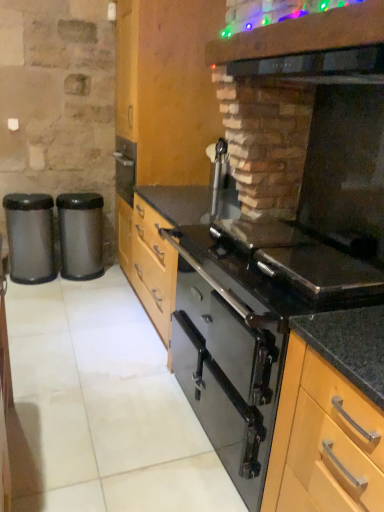
Question: Is light wood cabinet at center, which is the second cabinetry from back to front, thinner than black glass oven at center?

Choices:
 (A) yes
 (B) no

Answer: (A)

Question: From a real-world perspective, is light wood cabinet at center, which is the second cabinetry from back to front, beneath black glass oven at center?

Choices:
 (A) yes
 (B) no

Answer: (B)

Question: From a real-world perspective, is light wood cabinet at center, arranged as the 1th cabinetry when viewed from the right, physically above black glass oven at center?

Choices:
 (A) yes
 (B) no

Answer: (A)

Question: Is light wood cabinet at center, marked as the 1th cabinetry in a front-to-back arrangement, positioned before black glass oven at center?

Choices:
 (A) no
 (B) yes

Answer: (B)

Question: Can you confirm if light wood cabinet at center, marked as the 1th cabinetry in a front-to-back arrangement, is bigger than black glass oven at center?

Choices:
 (A) yes
 (B) no

Answer: (B)

Question: From the image's perspective, is black glass exhaust hood at upper right above or below satin black trash can at left, the first waste container from the right?

Choices:
 (A) below
 (B) above

Answer: (B)

Question: From a real-world perspective, relative to satin black trash can at left, the first waste container from the right, is black glass exhaust hood at upper right vertically above or below?

Choices:
 (A) above
 (B) below

Answer: (A)

Question: Considering the positions of black glass exhaust hood at upper right and satin black trash can at left, the first waste container from the right, in the image, is black glass exhaust hood at upper right taller or shorter than satin black trash can at left, the first waste container from the right,?

Choices:
 (A) short
 (B) tall

Answer: (A)

Question: Is black glass exhaust hood at upper right wider or thinner than satin black trash can at left, arranged as the 2th waste container when viewed from the left?

Choices:
 (A) thin
 (B) wide

Answer: (B)

Question: Considering the relative positions of wooden cabinet at center, the 2th cabinetry from the front, and black glass oven at center in the image provided, is wooden cabinet at center, the 2th cabinetry from the front, to the left or to the right of black glass oven at center?

Choices:
 (A) right
 (B) left

Answer: (B)

Question: Is wooden cabinet at center, which is the first cabinetry in back-to-front order, inside or outside of black glass oven at center?

Choices:
 (A) inside
 (B) outside

Answer: (B)

Question: Considering the positions of wooden cabinet at center, the 2th cabinetry from the right, and black glass oven at center in the image, is wooden cabinet at center, the 2th cabinetry from the right, taller or shorter than black glass oven at center?

Choices:
 (A) tall
 (B) short

Answer: (A)

Question: From the image's perspective, is wooden cabinet at center, the 2th cabinetry when ordered from bottom to top, above or below black glass oven at center?

Choices:
 (A) below
 (B) above

Answer: (B)

Question: From the image's perspective, relative to wooden cabinet at center, the 2th cabinetry from the front, is black glass oven at center above or below?

Choices:
 (A) below
 (B) above

Answer: (A)

Question: In the image, is black glass oven at center positioned in front of or behind wooden cabinet at center, the 2th cabinetry from the front?

Choices:
 (A) behind
 (B) front

Answer: (B)